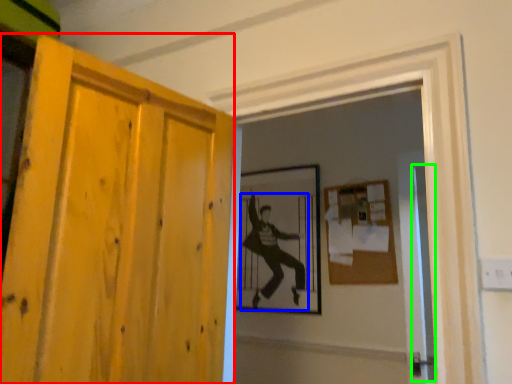
Question: Based on their relative distances, which object is nearer to door (highlighted by a red box)? Choose from person (highlighted by a blue box) and screen door (highlighted by a green box).

Choices:
 (A) person
 (B) screen door

Answer: (B)